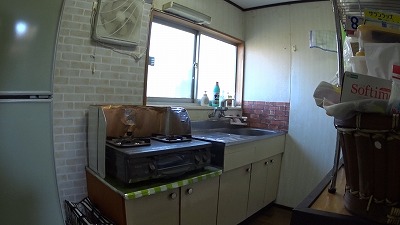
The width and height of the screenshot is (400, 225). I want to click on sink faucet, so click(227, 116).